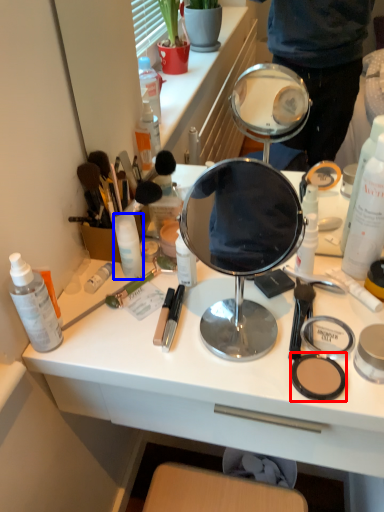
Question: Among these objects, which one is farthest to the camera, face powder (highlighted by a red box) or toiletry (highlighted by a blue box)?

Choices:
 (A) face powder
 (B) toiletry

Answer: (B)